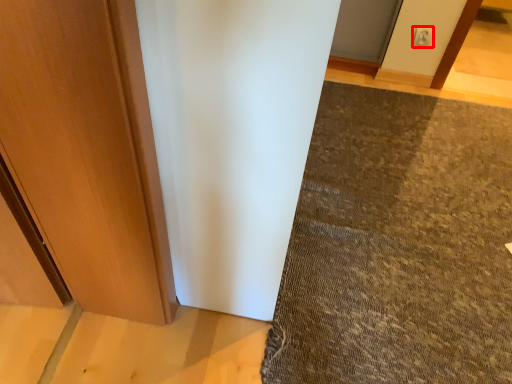
Question: From the image, what is the correct spatial relationship of electric outlet (annotated by the red box) in relation to mat?

Choices:
 (A) right
 (B) left

Answer: (A)